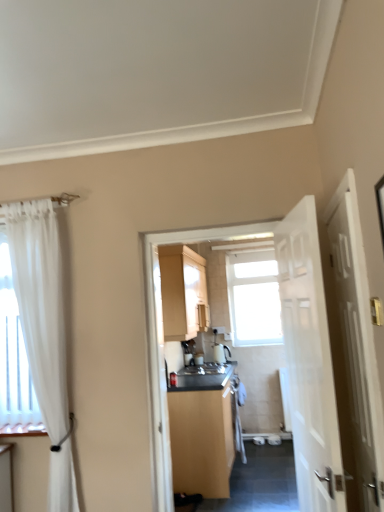
Question: Is matte wood cabinet at center, which is counted as the second cabinetry, starting from the top, located outside white glossy sink at center?

Choices:
 (A) no
 (B) yes

Answer: (B)

Question: Does matte wood cabinet at center, which is the first cabinetry in bottom-to-top order, have a larger size compared to white glossy sink at center?

Choices:
 (A) no
 (B) yes

Answer: (B)

Question: From a real-world perspective, is matte wood cabinet at center, which is the first cabinetry in bottom-to-top order, positioned over white glossy sink at center based on gravity?

Choices:
 (A) yes
 (B) no

Answer: (B)

Question: Does matte wood cabinet at center, which is counted as the second cabinetry, starting from the top, turn towards white glossy sink at center?

Choices:
 (A) yes
 (B) no

Answer: (B)

Question: From the image's perspective, is matte wood cabinet at center, which is counted as the second cabinetry, starting from the top, beneath white glossy sink at center?

Choices:
 (A) yes
 (B) no

Answer: (A)

Question: In the image, is transparent glass window at center positioned in front of or behind white sheer curtain at left?

Choices:
 (A) behind
 (B) front

Answer: (A)

Question: Considering the positions of transparent glass window at center and white sheer curtain at left in the image, is transparent glass window at center wider or thinner than white sheer curtain at left?

Choices:
 (A) wide
 (B) thin

Answer: (B)

Question: Would you say transparent glass window at center is inside or outside white sheer curtain at left?

Choices:
 (A) inside
 (B) outside

Answer: (B)

Question: In terms of height, does transparent glass window at center look taller or shorter compared to white sheer curtain at left?

Choices:
 (A) short
 (B) tall

Answer: (A)

Question: Looking at their shapes, would you say white glossy sink at center is wider or thinner than white glossy door at right, the 2th door from the left?

Choices:
 (A) wide
 (B) thin

Answer: (A)

Question: In terms of height, does white glossy sink at center look taller or shorter compared to white glossy door at right, the 2th door from the left?

Choices:
 (A) short
 (B) tall

Answer: (A)

Question: In the image, is white glossy sink at center on the left side or the right side of white glossy door at right, the 2th door from the left?

Choices:
 (A) right
 (B) left

Answer: (B)

Question: Considering the positions of point (190, 373) and point (336, 243), is point (190, 373) closer or farther from the camera than point (336, 243)?

Choices:
 (A) closer
 (B) farther

Answer: (B)

Question: Would you say matte wood cabinet at center, the second cabinetry from the bottom, is to the left or to the right of matte wood cabinet at center, which is counted as the second cabinetry, starting from the top, in the picture?

Choices:
 (A) left
 (B) right

Answer: (A)

Question: Based on their sizes in the image, would you say matte wood cabinet at center, the second cabinetry from the bottom, is bigger or smaller than matte wood cabinet at center, which is counted as the second cabinetry, starting from the top?

Choices:
 (A) small
 (B) big

Answer: (A)